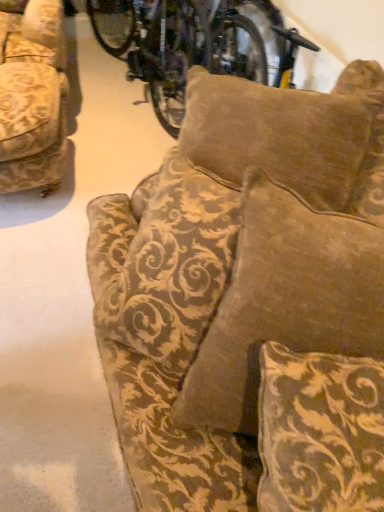
Question: Does brown velvety pillow at upper center, placed as the 2th pillow when sorted from bottom to top, turn towards velvet gold-patterned pillow at center, the second pillow in the back-to-front sequence?

Choices:
 (A) yes
 (B) no

Answer: (B)

Question: Can you confirm if brown velvety pillow at upper center, placed as the 2th pillow when sorted from bottom to top, is positioned to the left of velvet gold-patterned pillow at center, the 1th pillow from the front?

Choices:
 (A) yes
 (B) no

Answer: (A)

Question: Considering the relative sizes of brown velvety pillow at upper center, the 1th pillow positioned from the back, and velvet gold-patterned pillow at center, the 2th pillow when ordered from top to bottom, in the image provided, is brown velvety pillow at upper center, the 1th pillow positioned from the back, wider than velvet gold-patterned pillow at center, the 2th pillow when ordered from top to bottom,?

Choices:
 (A) yes
 (B) no

Answer: (A)

Question: Considering the relative sizes of brown velvety pillow at upper center, placed as the 2th pillow when sorted from bottom to top, and velvet gold-patterned pillow at center, which is the first pillow in bottom-to-top order, in the image provided, is brown velvety pillow at upper center, placed as the 2th pillow when sorted from bottom to top, taller than velvet gold-patterned pillow at center, which is the first pillow in bottom-to-top order,?

Choices:
 (A) no
 (B) yes

Answer: (B)

Question: Does brown velvety pillow at upper center, placed as the 2th pillow when sorted from bottom to top, have a lesser height compared to velvet gold-patterned pillow at center, which is the first pillow in bottom-to-top order?

Choices:
 (A) no
 (B) yes

Answer: (A)

Question: From the image's perspective, is brown velvety pillow at upper center, which is the 1th pillow in top-to-bottom order, below velvet gold-patterned pillow at center, the 2th pillow when ordered from top to bottom?

Choices:
 (A) no
 (B) yes

Answer: (A)

Question: Considering the relative sizes of metallic silver bicycle at upper center and brown velvety pillow at upper center, the 1th pillow positioned from the back, in the image provided, is metallic silver bicycle at upper center wider than brown velvety pillow at upper center, the 1th pillow positioned from the back,?

Choices:
 (A) yes
 (B) no

Answer: (B)

Question: Is metallic silver bicycle at upper center closer to the viewer compared to brown velvety pillow at upper center, the 1th pillow positioned from the back?

Choices:
 (A) yes
 (B) no

Answer: (B)

Question: From a real-world perspective, is metallic silver bicycle at upper center physically above brown velvety pillow at upper center, which is the 1th pillow in top-to-bottom order?

Choices:
 (A) no
 (B) yes

Answer: (A)

Question: Is metallic silver bicycle at upper center completely or partially outside of brown velvety pillow at upper center, placed as the 2th pillow when sorted from bottom to top?

Choices:
 (A) yes
 (B) no

Answer: (B)

Question: Does metallic silver bicycle at upper center contain brown velvety pillow at upper center, which is the 1th pillow in top-to-bottom order?

Choices:
 (A) yes
 (B) no

Answer: (A)

Question: Does metallic silver bicycle at upper center have a smaller size compared to brown velvety pillow at upper center, the 1th pillow positioned from the back?

Choices:
 (A) yes
 (B) no

Answer: (A)

Question: Would you say velvet gold-patterned couch at center, which is the first studio couch from bottom to top, is part of gold-patterned fabric couch at left, which is the second studio couch from bottom to top,'s contents?

Choices:
 (A) yes
 (B) no

Answer: (B)